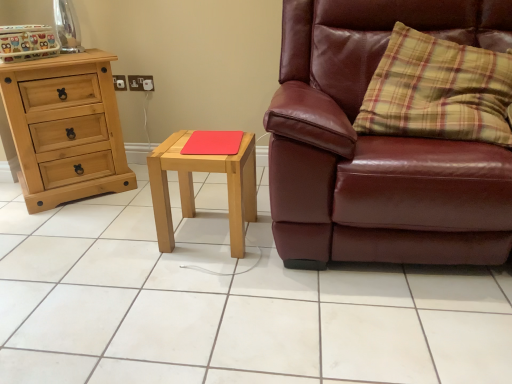
Question: Considering the positions of point (467, 72) and point (307, 258), is point (467, 72) closer or farther from the camera than point (307, 258)?

Choices:
 (A) closer
 (B) farther

Answer: (B)

Question: Is yellow plaid pillow at right bigger or smaller than leather couch at right?

Choices:
 (A) big
 (B) small

Answer: (B)

Question: Which object is positioned farthest from the light wood/matte nightstand at center?

Choices:
 (A) red matte mousepad at center
 (B) natural wood chest of drawers at left
 (C) white glossy tile at center
 (D) leather couch at right
 (E) yellow plaid pillow at right

Answer: (E)

Question: Which of these objects is positioned closest to the yellow plaid pillow at right?

Choices:
 (A) light wood/matte nightstand at center
 (B) natural wood chest of drawers at left
 (C) leather couch at right
 (D) white glossy tile at center
 (E) red matte mousepad at center

Answer: (C)